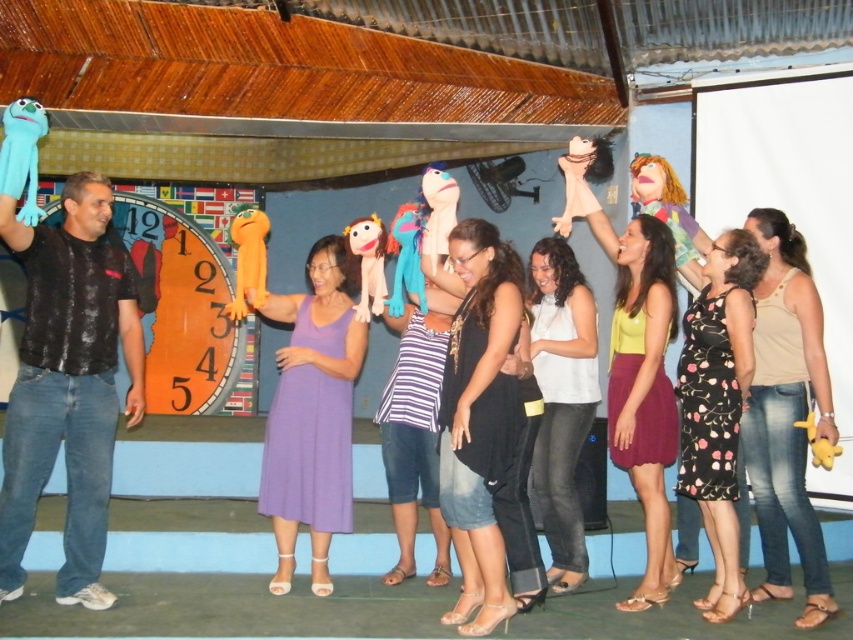
In the scene shown: You are a photographer trying to capture a clear photo of both the purple matte dress at center and the matte blue puppet at center during the performance. Since you want both subjects to be in focus, which object should you adjust your camera focus on first to ensure proper depth of field?

The purple matte dress at center is larger than the matte blue puppet at center, so you should focus on the purple matte dress at center first to ensure both are in focus.

You are a photographer positioned at the origin of the coordinate system. You need to capture a closeup shot of the black matte shirt at left. Given that your camera can only focus on objects within a 0.1 unit radius from the point you choose, would the point at coordinates (68, 384) be suitable for focusing to get the black matte shirt at left in focus?

Yes, the point at coordinates (68, 384) marks the black matte shirt at left, so focusing there would place the black matte shirt at left within the camera focus range of 0.1 units.

From the picture: You are a photographer standing at the back of the stage. You want to take a photo of the black matte shirt at left and the matte blue puppet at center. Can you fit both in your camera frame if your frame can only accommodate objects up to 1 meter in width?

The black matte shirt at left might be wider than matte blue puppet at center, so it is uncertain if both can fit within the 1 meter width constraint. The photographer should check the combined width of both objects to ensure they fit.